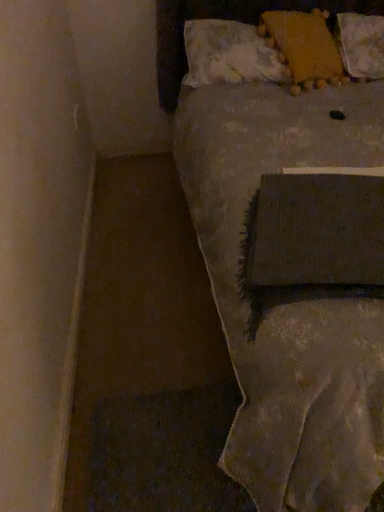
Question: Can yellow fabric pillow at upper right, the first pillow from the left, be found inside textured gray blanket at center?

Choices:
 (A) yes
 (B) no

Answer: (A)

Question: Does textured gray blanket at center have a lesser height compared to yellow fabric pillow at upper right, the first pillow from the left?

Choices:
 (A) no
 (B) yes

Answer: (A)

Question: Can you confirm if textured gray blanket at center is taller than yellow fabric pillow at upper right, the first pillow from the left?

Choices:
 (A) no
 (B) yes

Answer: (B)

Question: Does textured gray blanket at center appear on the right side of yellow fabric pillow at upper right, the first pillow from the left?

Choices:
 (A) no
 (B) yes

Answer: (B)

Question: Can you confirm if textured gray blanket at center is thinner than yellow fabric pillow at upper right, positioned as the 3th pillow in right-to-left order?

Choices:
 (A) no
 (B) yes

Answer: (A)

Question: Based on their positions, is yellow fabric pillow at upper right, the first pillow from the left, located to the left or right of yellow fabric pillow at upper right, which appears as the 2th pillow when viewed from the right?

Choices:
 (A) left
 (B) right

Answer: (A)

Question: In terms of width, does yellow fabric pillow at upper right, the first pillow from the left, look wider or thinner when compared to yellow fabric pillow at upper right, which appears as the 2th pillow when viewed from the right?

Choices:
 (A) wide
 (B) thin

Answer: (B)

Question: From a real-world perspective, is yellow fabric pillow at upper right, positioned as the 3th pillow in right-to-left order, physically located above or below yellow fabric pillow at upper right, the 2th pillow from the left?

Choices:
 (A) below
 (B) above

Answer: (A)

Question: Considering the positions of point (235, 25) and point (297, 77), is point (235, 25) closer or farther from the camera than point (297, 77)?

Choices:
 (A) closer
 (B) farther

Answer: (B)

Question: Relative to fluffy yellow pillow at upper right, the 3th pillow when ordered from left to right, is textured gray blanket at center in front or behind?

Choices:
 (A) front
 (B) behind

Answer: (A)

Question: Based on their positions, is textured gray blanket at center located to the left or right of fluffy yellow pillow at upper right, the 3th pillow when ordered from left to right?

Choices:
 (A) left
 (B) right

Answer: (A)

Question: Is textured gray blanket at center bigger or smaller than fluffy yellow pillow at upper right, the 3th pillow when ordered from left to right?

Choices:
 (A) big
 (B) small

Answer: (A)

Question: Does point (261, 340) appear closer or farther from the camera than point (374, 58)?

Choices:
 (A) closer
 (B) farther

Answer: (A)

Question: Relative to yellow fabric pillow at upper right, the first pillow from the left, is textured gray blanket at center in front or behind?

Choices:
 (A) behind
 (B) front

Answer: (B)

Question: Looking at their shapes, would you say textured gray blanket at center is wider or thinner than yellow fabric pillow at upper right, the first pillow from the left?

Choices:
 (A) thin
 (B) wide

Answer: (B)